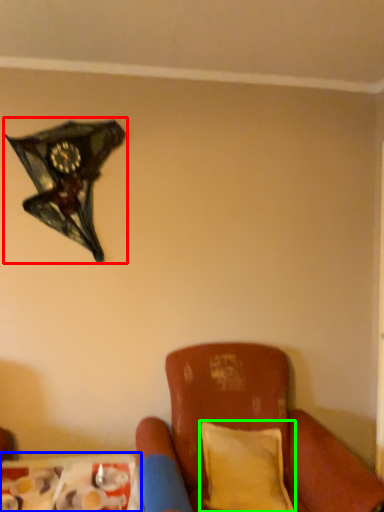
Question: Which object is positioned closest to lamp (highlighted by a red box)? Select from table (highlighted by a blue box) and pillow (highlighted by a green box).

Choices:
 (A) table
 (B) pillow

Answer: (A)